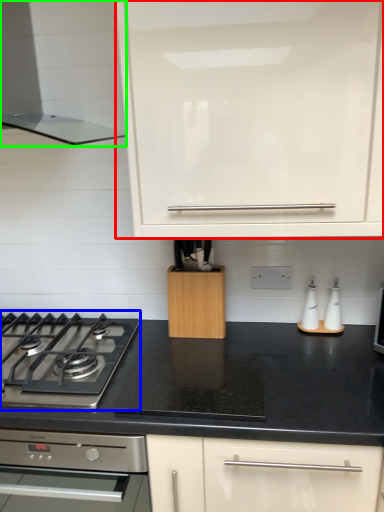
Question: Which object is the farthest from cabinetry (highlighted by a red box)? Choose among these: gas stove (highlighted by a blue box) or home appliance (highlighted by a green box).

Choices:
 (A) gas stove
 (B) home appliance

Answer: (A)